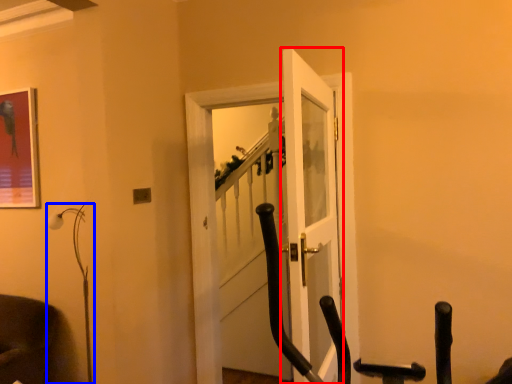
Question: Which point is closer to the camera, door (highlighted by a red box) or lamp (highlighted by a blue box)?

Choices:
 (A) door
 (B) lamp

Answer: (A)